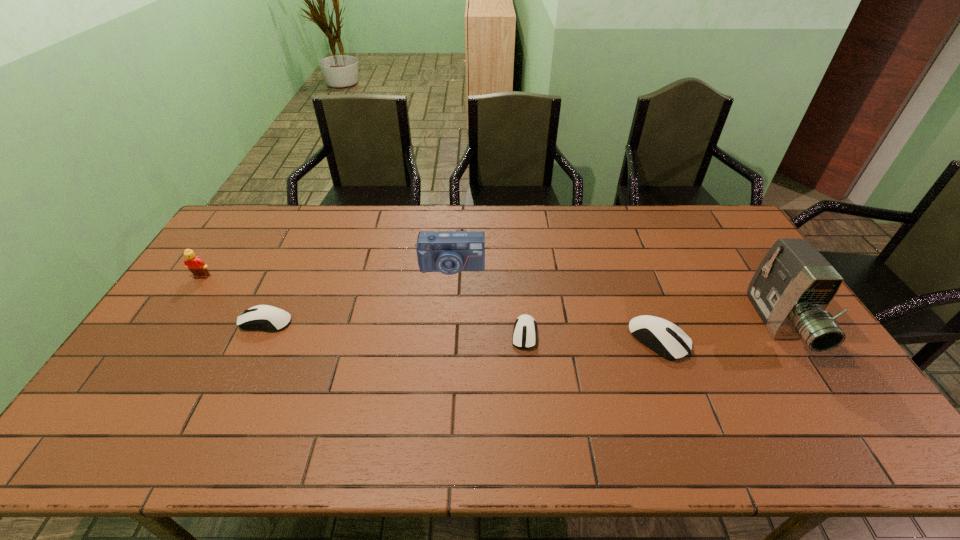
Find the location of a particular element. The width and height of the screenshot is (960, 540). vacant space at the far right corner is located at coordinates (687, 205).

Find the location of `vacant region at the near right corner of the desktop`. vacant region at the near right corner of the desktop is located at coordinates click(828, 410).

Find the location of a particular element. This screenshot has height=540, width=960. vacant area that lies between the fifth tallest object and the leftmost object is located at coordinates (234, 299).

The height and width of the screenshot is (540, 960). Identify the location of free space between the second shortest object and the third object from left to right. (359, 295).

Where is `empty space that is in between the camcorder and the third object from left to right`? The height and width of the screenshot is (540, 960). empty space that is in between the camcorder and the third object from left to right is located at coordinates (615, 296).

Locate an element on the screen. Image resolution: width=960 pixels, height=540 pixels. unoccupied position between the Lego and the rightmost mouse is located at coordinates (430, 308).

Where is `free space between the rightmost object and the leftmost object`? free space between the rightmost object and the leftmost object is located at coordinates (491, 301).

Identify the location of vacant space that's between the third tallest object and the camcorder. This screenshot has height=540, width=960. (491, 301).

Find the location of a particular element. The height and width of the screenshot is (540, 960). free space between the Lego and the second tallest mouse is located at coordinates (234, 299).

I want to click on vacant region between the camera and the shortest mouse, so click(x=488, y=301).